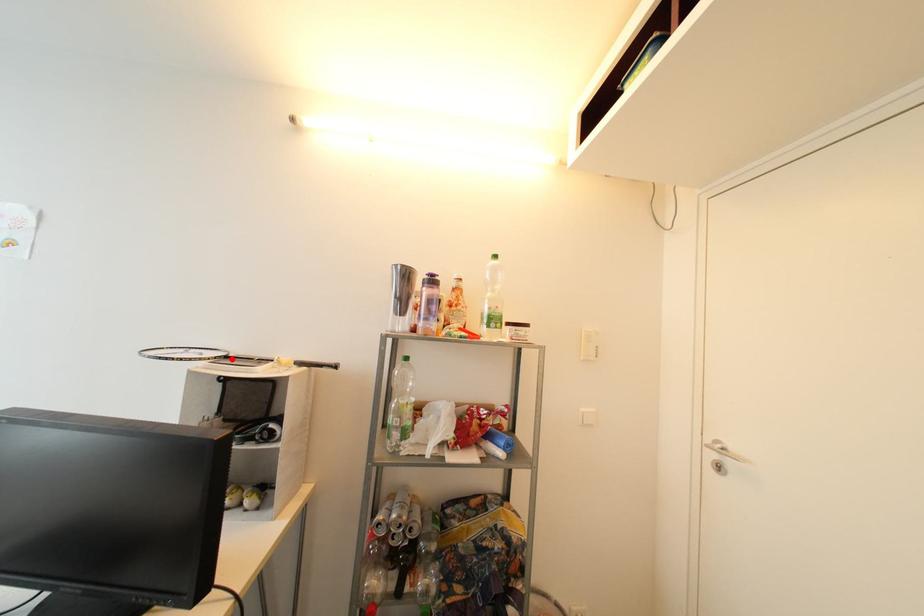
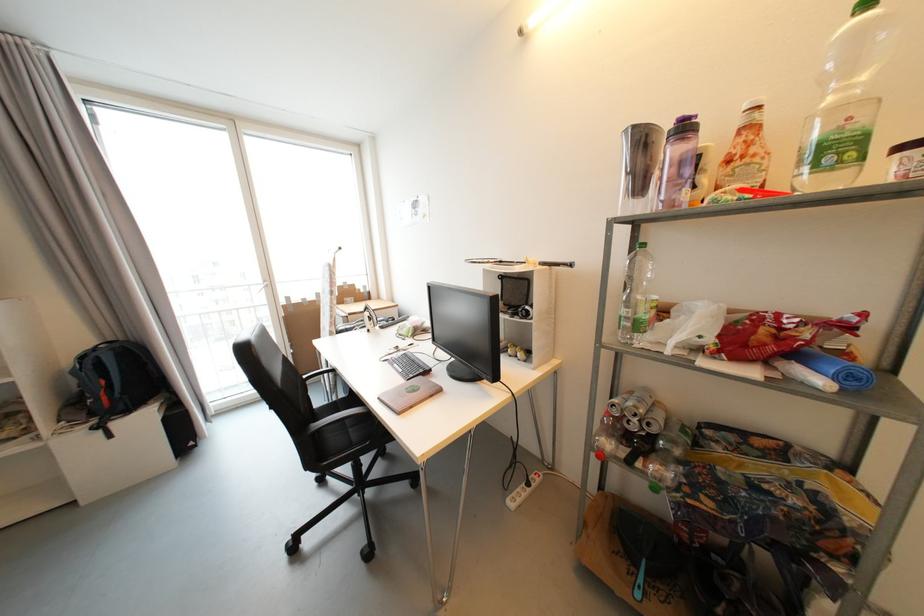
In the second image, find the point that corresponds to the highlighted location in the first image.

(505, 264)